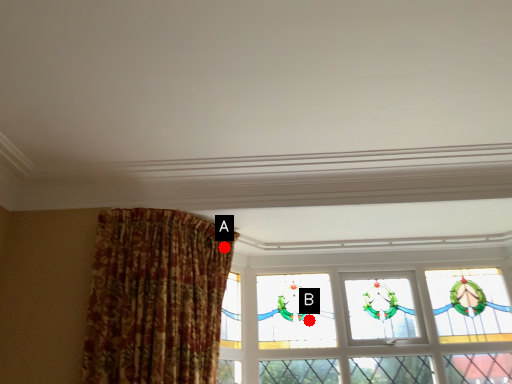
Question: Two points are circled on the image, labeled by A and B beside each circle. Which point is farther from the camera taking this photo?

Choices:
 (A) A is further
 (B) B is further

Answer: (B)